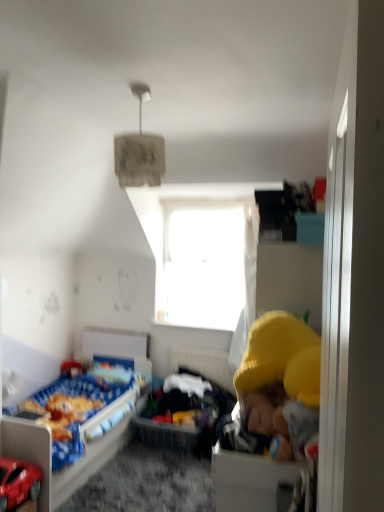
Question: Can you confirm if white plastic drawer at lower right is thinner than transparent glass window at center?

Choices:
 (A) yes
 (B) no

Answer: (B)

Question: Is white plastic drawer at lower right further to the viewer compared to transparent glass window at center?

Choices:
 (A) no
 (B) yes

Answer: (A)

Question: Considering the relative sizes of white plastic drawer at lower right and transparent glass window at center in the image provided, is white plastic drawer at lower right wider than transparent glass window at center?

Choices:
 (A) no
 (B) yes

Answer: (B)

Question: Would you say white plastic drawer at lower right is a long distance from transparent glass window at center?

Choices:
 (A) no
 (B) yes

Answer: (B)

Question: Is white plastic drawer at lower right taller than transparent glass window at center?

Choices:
 (A) yes
 (B) no

Answer: (B)

Question: Is white plastic drawer at lower right facing away from transparent glass window at center?

Choices:
 (A) yes
 (B) no

Answer: (B)

Question: Can you confirm if soft fabric basket at center is wider than white plastic drawer at lower right?

Choices:
 (A) no
 (B) yes

Answer: (B)

Question: Does soft fabric basket at center come behind white plastic drawer at lower right?

Choices:
 (A) no
 (B) yes

Answer: (B)

Question: Can you confirm if soft fabric basket at center is taller than white plastic drawer at lower right?

Choices:
 (A) yes
 (B) no

Answer: (A)

Question: From the image's perspective, does soft fabric basket at center appear lower than white plastic drawer at lower right?

Choices:
 (A) yes
 (B) no

Answer: (A)

Question: Is white plastic drawer at lower right completely or partially inside soft fabric basket at center?

Choices:
 (A) yes
 (B) no

Answer: (B)

Question: Could you tell me if soft fabric basket at center is facing white plastic drawer at lower right?

Choices:
 (A) yes
 (B) no

Answer: (A)

Question: Does shiny red car at lower left come behind textured paper lampshade at upper center?

Choices:
 (A) yes
 (B) no

Answer: (A)